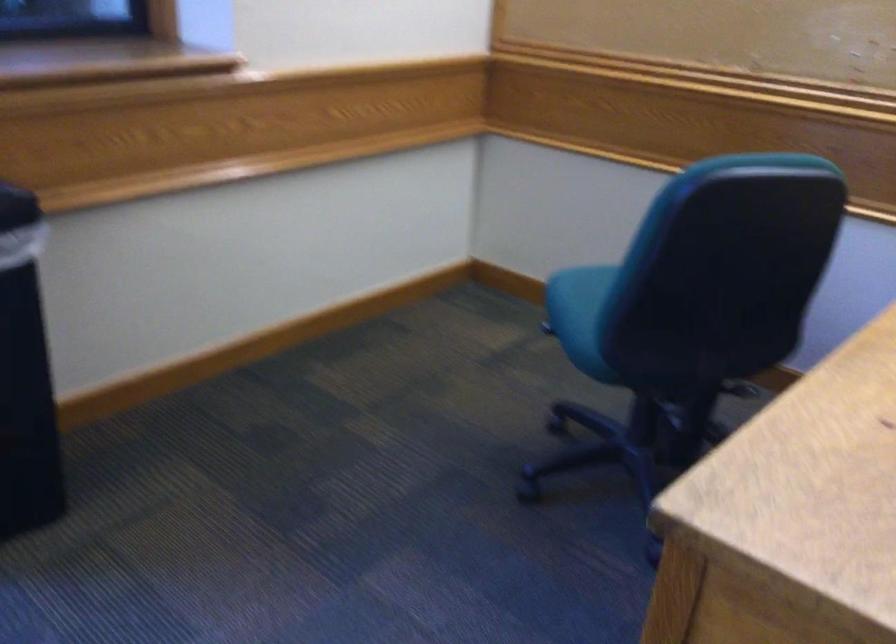
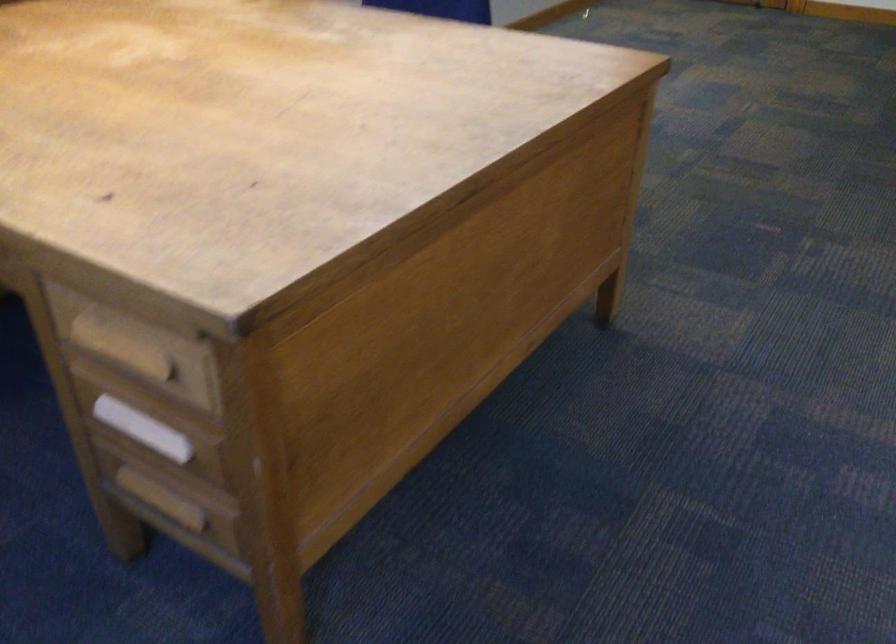
The images are taken continuously from a first-person perspective. In which direction is your viewpoint rotating?

The rotation direction of the camera is right-down.